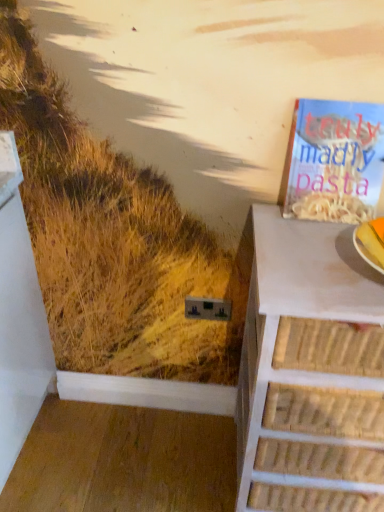
From the picture: What is the approximate width of matte paper book at upper right?

matte paper book at upper right is 3.73 inches in width.

The height and width of the screenshot is (512, 384). What do you see at coordinates (333, 161) in the screenshot? I see `matte paper book at upper right` at bounding box center [333, 161].

This screenshot has height=512, width=384. I want to click on matte paper book at upper right, so click(x=333, y=161).

You are a GUI agent. You are given a task and a screenshot of the screen. Output one action in this format:
    pyautogui.click(x=<x>, y=<y>)
    Task: Click on the white wicker chest of drawers at right
    
    Given the screenshot: What is the action you would take?
    pyautogui.click(x=309, y=370)

This screenshot has width=384, height=512. Describe the element at coordinates (309, 370) in the screenshot. I see `white wicker chest of drawers at right` at that location.

This screenshot has height=512, width=384. I want to click on matte paper book at upper right, so click(333, 161).

Is white wicker chest of drawers at right at the right side of matte paper book at upper right?

Yes.

Does white wicker chest of drawers at right lie behind matte paper book at upper right?

No, white wicker chest of drawers at right is closer to the viewer.

Between point (293, 220) and point (366, 145), which one is positioned behind?

Positioned behind is point (293, 220).

From the image's perspective, is white wicker chest of drawers at right below matte paper book at upper right?

Correct, white wicker chest of drawers at right appears lower than matte paper book at upper right in the image.

From a real-world perspective, is white wicker chest of drawers at right beneath matte paper book at upper right?

Correct, in the physical world, white wicker chest of drawers at right is lower than matte paper book at upper right.

Between white wicker chest of drawers at right and matte paper book at upper right, which one has larger width?

white wicker chest of drawers at right is wider.

Who is taller, white wicker chest of drawers at right or matte paper book at upper right?

Standing taller between the two is white wicker chest of drawers at right.

In terms of size, does white wicker chest of drawers at right appear bigger or smaller than matte paper book at upper right?

Clearly, white wicker chest of drawers at right is larger in size than matte paper book at upper right.

Could matte paper book at upper right be considered to be inside white wicker chest of drawers at right?

No, white wicker chest of drawers at right does not contain matte paper book at upper right.

Is the surface of white wicker chest of drawers at right in direct contact with matte paper book at upper right?

No, white wicker chest of drawers at right is not making contact with matte paper book at upper right.

Is white wicker chest of drawers at right positioned with its back to matte paper book at upper right?

white wicker chest of drawers at right is not turned away from matte paper book at upper right.

Find the location of a particular element. book above the white wicker chest of drawers at right (from the image's perspective) is located at coordinates click(333, 161).

Considering the positions of objects matte paper book at upper right and white wicker chest of drawers at right in the image provided, who is more to the right, matte paper book at upper right or white wicker chest of drawers at right?

From the viewer's perspective, white wicker chest of drawers at right appears more on the right side.

Is matte paper book at upper right closer to the viewer compared to white wicker chest of drawers at right?

No, matte paper book at upper right is behind white wicker chest of drawers at right.

Is point (340, 218) farther from viewer compared to point (263, 275)?

Yes, point (340, 218) is farther from viewer.

From the image's perspective, between matte paper book at upper right and white wicker chest of drawers at right, who is located below?

white wicker chest of drawers at right appears lower in the image.

From a real-world perspective, who is located higher, matte paper book at upper right or white wicker chest of drawers at right?

In real-world perspective, matte paper book at upper right is above.

Between matte paper book at upper right and white wicker chest of drawers at right, which one has larger width?

Wider between the two is white wicker chest of drawers at right.

Is matte paper book at upper right shorter than white wicker chest of drawers at right?

Indeed, matte paper book at upper right has a lesser height compared to white wicker chest of drawers at right.

Based on their sizes in the image, would you say matte paper book at upper right is bigger or smaller than white wicker chest of drawers at right?

In the image, matte paper book at upper right appears to be smaller than white wicker chest of drawers at right.

Is white wicker chest of drawers at right surrounded by matte paper book at upper right?

Definitely not — white wicker chest of drawers at right is not inside matte paper book at upper right.

Is matte paper book at upper right touching white wicker chest of drawers at right?

matte paper book at upper right and white wicker chest of drawers at right are not in contact.

Is matte paper book at upper right oriented away from white wicker chest of drawers at right?

No, matte paper book at upper right's orientation is not away from white wicker chest of drawers at right.

What's the angular difference between matte paper book at upper right and white wicker chest of drawers at right's facing directions?

There is a 0.0719-degree angle between the facing directions of matte paper book at upper right and white wicker chest of drawers at right.

Where is `chest of drawers below the matte paper book at upper right (from a real-world perspective)`? The height and width of the screenshot is (512, 384). chest of drawers below the matte paper book at upper right (from a real-world perspective) is located at coordinates (309, 370).

The image size is (384, 512). Identify the location of chest of drawers on the right side of matte paper book at upper right. click(x=309, y=370).

The height and width of the screenshot is (512, 384). I want to click on chest of drawers below the matte paper book at upper right (from a real-world perspective), so click(x=309, y=370).